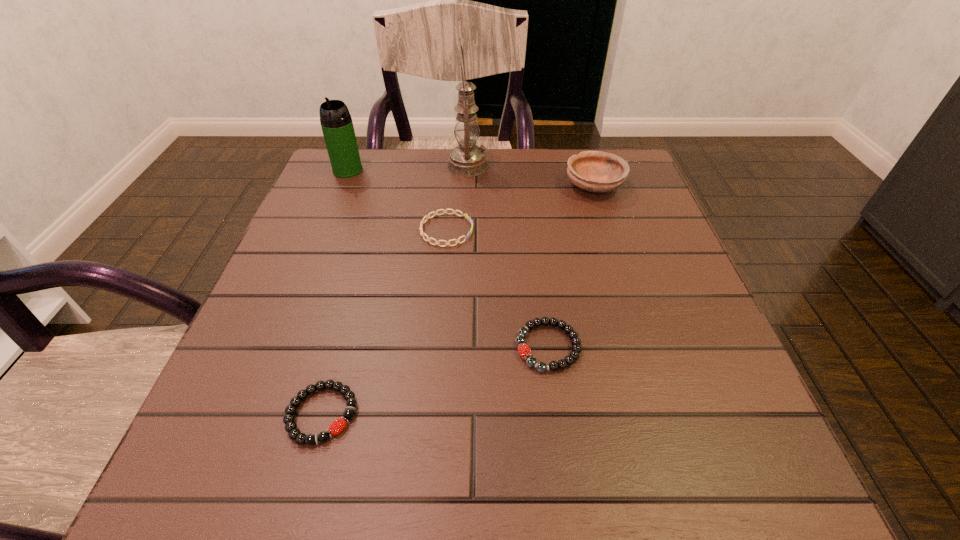
You are a GUI agent. You are given a task and a screenshot of the screen. Output one action in this format:
    pyautogui.click(x=<x>, y=<y>)
    Task: Click on the free spot that satisfies the following two spatial constraints: 1. on the back side of the nearest bracelet; 2. on the left side of the fifth object from left to right
    This screenshot has width=960, height=540.
    Given the screenshot: What is the action you would take?
    (340, 347)

The width and height of the screenshot is (960, 540). Find the location of `vacant space that satisfies the following two spatial constraints: 1. on the surface of the farthest bracelet showing star-shaped elements; 2. on the right side of the second farthest bracelet`. vacant space that satisfies the following two spatial constraints: 1. on the surface of the farthest bracelet showing star-shaped elements; 2. on the right side of the second farthest bracelet is located at coordinates (437, 347).

Where is `free space that satisfies the following two spatial constraints: 1. from the spout of the thermos bottle; 2. on the right side of the rightmost object`? The width and height of the screenshot is (960, 540). free space that satisfies the following two spatial constraints: 1. from the spout of the thermos bottle; 2. on the right side of the rightmost object is located at coordinates (342, 186).